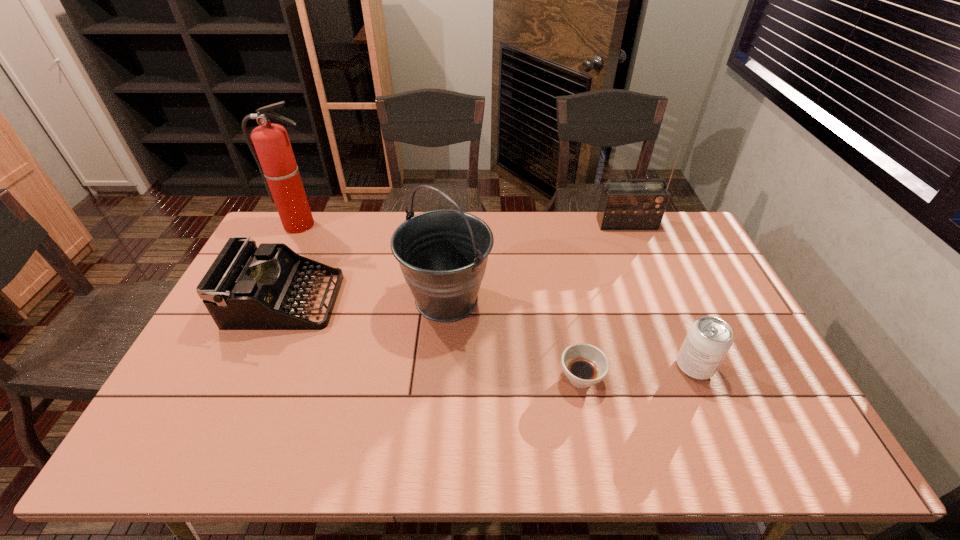
Identify the location of vacant area in the image that satisfies the following two spatial constraints: 1. on the typing side of the typewriter; 2. on the right side of the soda can. (255, 367).

Identify the location of free spot that satisfies the following two spatial constraints: 1. with the nozzle and gauge on the fire extinguisher; 2. on the left side of the shortest object. (225, 378).

Find the location of a particular element. blank area in the image that satisfies the following two spatial constraints: 1. on the front panel of the third tallest object; 2. on the right side of the soda can is located at coordinates (685, 367).

Find the location of a particular element. The height and width of the screenshot is (540, 960). vacant region that satisfies the following two spatial constraints: 1. with the nozzle and gauge on the soda can; 2. on the right side of the fire extinguisher is located at coordinates (230, 367).

Locate an element on the screen. free space that satisfies the following two spatial constraints: 1. on the typing side of the typewriter; 2. on the back side of the soda can is located at coordinates click(x=255, y=367).